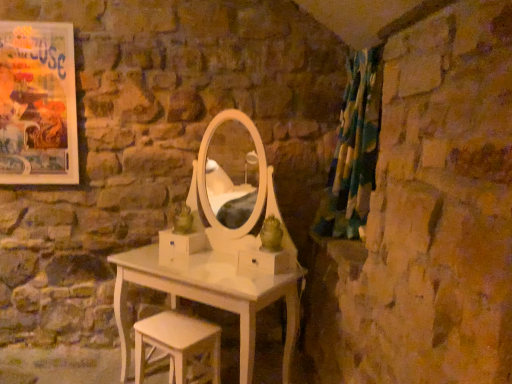
Question: Is white wood stool at lower center wider or thinner than matte paper poster at upper left?

Choices:
 (A) wide
 (B) thin

Answer: (A)

Question: Considering their positions, is white wood stool at lower center located in front of or behind matte paper poster at upper left?

Choices:
 (A) behind
 (B) front

Answer: (B)

Question: Which of these objects is positioned farthest from the multicolored fabric curtain at right?

Choices:
 (A) matte paper poster at upper left
 (B) white wood stool at lower center

Answer: (A)

Question: Estimate the real-world distances between objects in this image. Which object is closer to the matte paper poster at upper left?

Choices:
 (A) white wood stool at lower center
 (B) multicolored fabric curtain at right

Answer: (A)